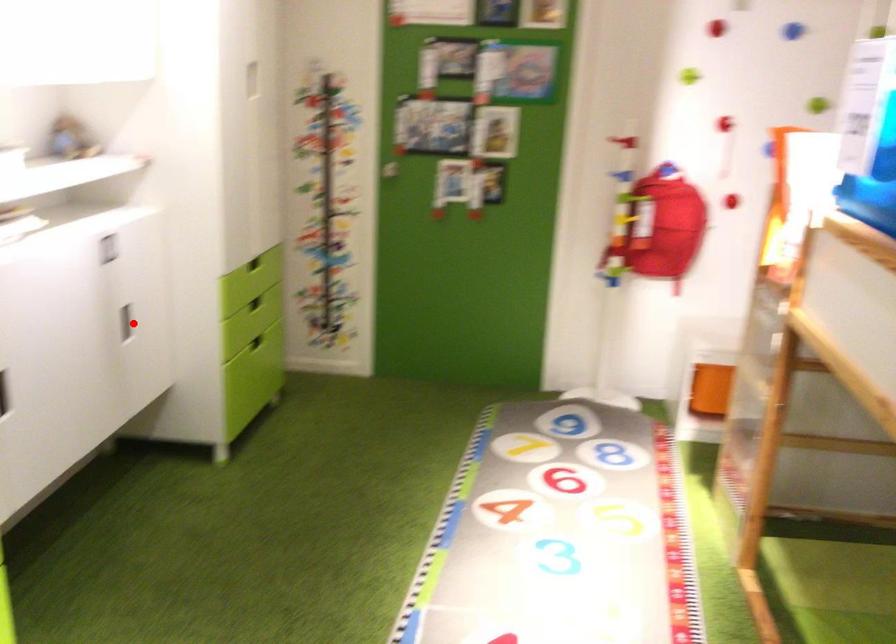
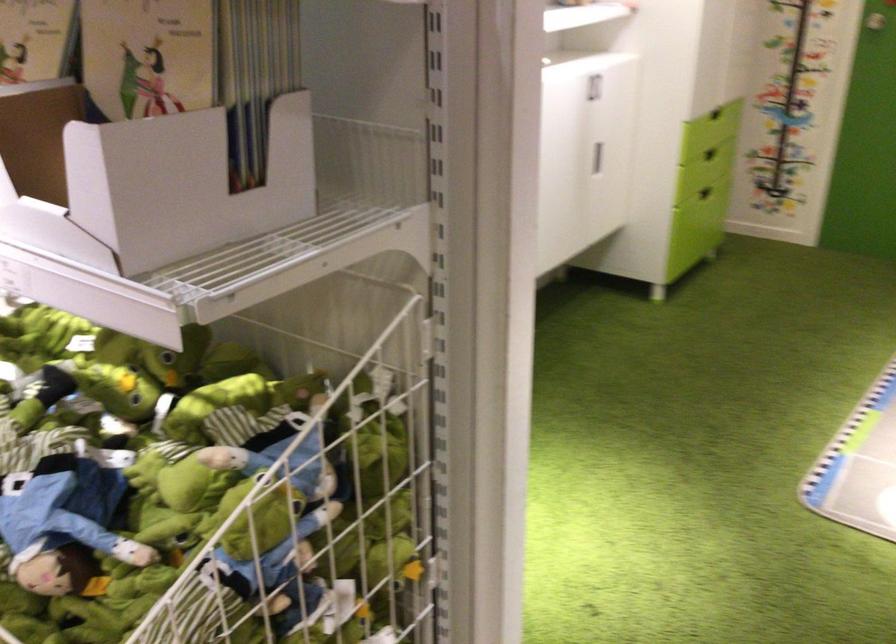
Question: I am providing you with two images of the same scene from different viewpoints. Image1 has a red point marked. In image2, the corresponding 3D location appears at what relative position? Reply with the corresponding letter.

Choices:
 (A) Closer
 (B) Farther

Answer: (B)